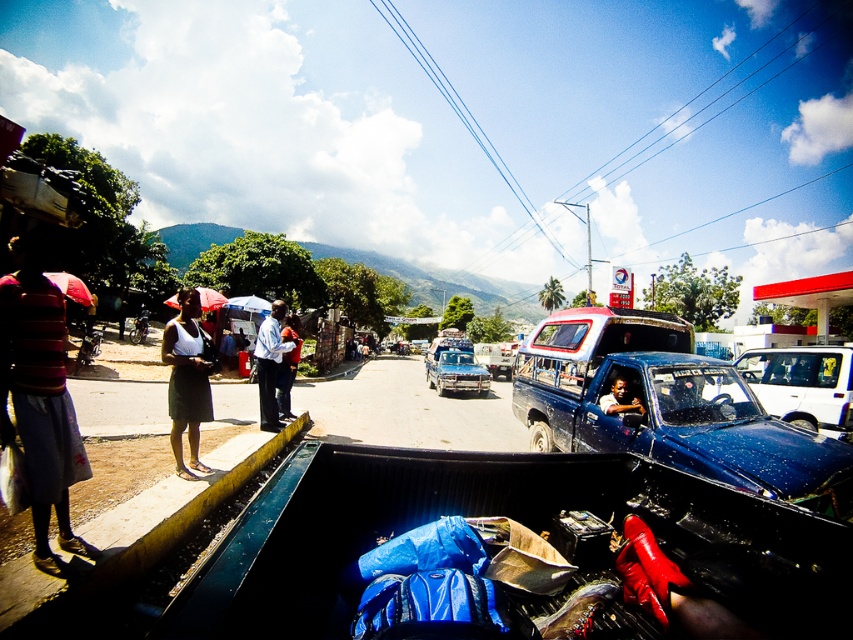
Locate an element on the screen. The image size is (853, 640). blue matte pickup truck at center is located at coordinates (668, 406).

Does blue matte pickup truck at center appear on the left side of white matte dress at lower left?

No, blue matte pickup truck at center is not to the left of white matte dress at lower left.

Identify the location of blue matte pickup truck at center. Image resolution: width=853 pixels, height=640 pixels. (668, 406).

Where is `blue matte pickup truck at center`? The width and height of the screenshot is (853, 640). blue matte pickup truck at center is located at coordinates (668, 406).

Does white matte dress at lower left have a larger size compared to light blue shirt at center?

Correct, white matte dress at lower left is larger in size than light blue shirt at center.

Does white matte dress at lower left appear over light blue shirt at center?

No, white matte dress at lower left is not above light blue shirt at center.

Which is behind, point (183, 416) or point (262, 426)?

Point (262, 426)

Identify the location of white matte dress at lower left. (186, 380).

Is blue matte pickup truck at center above light blue shirt at center?

No.

Which is more to the right, blue matte pickup truck at center or light blue shirt at center?

From the viewer's perspective, blue matte pickup truck at center appears more on the right side.

Is point (563, 332) closer to viewer compared to point (273, 416)?

Yes, point (563, 332) is in front of point (273, 416).

This screenshot has height=640, width=853. Identify the location of blue matte pickup truck at center. (668, 406).